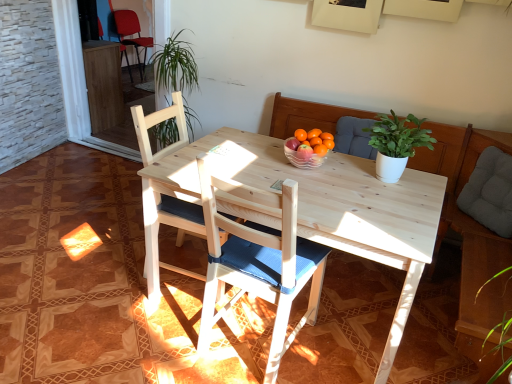
Question: Considering the relative positions of matte red chair at upper left, positioned as the first chair in top-to-bottom order, and wooden chair with blue cushion at center, which is the 1th chair in front-to-back order, in the image provided, is matte red chair at upper left, positioned as the first chair in top-to-bottom order, to the right of wooden chair with blue cushion at center, which is the 1th chair in front-to-back order, from the viewer's perspective?

Choices:
 (A) yes
 (B) no

Answer: (B)

Question: Could you tell me if matte red chair at upper left, the 3th chair ordered from the bottom, is facing wooden chair with blue cushion at center, the first chair when ordered from right to left?

Choices:
 (A) yes
 (B) no

Answer: (B)

Question: From the image's perspective, is matte red chair at upper left, the 3th chair ordered from the bottom, below wooden chair with blue cushion at center, the third chair from the top?

Choices:
 (A) yes
 (B) no

Answer: (B)

Question: Does matte red chair at upper left, the 1th chair from the left, have a lesser width compared to wooden chair with blue cushion at center, the third chair from the top?

Choices:
 (A) no
 (B) yes

Answer: (A)

Question: Can we say matte red chair at upper left, the third chair positioned from the right, lies outside wooden chair with blue cushion at center, which is counted as the third chair, starting from the back?

Choices:
 (A) yes
 (B) no

Answer: (A)

Question: Is matte red chair at upper left, the third chair positioned from the right, inside or outside of wooden chair with blue cushion at center, which is the 1th chair in front-to-back order?

Choices:
 (A) inside
 (B) outside

Answer: (B)

Question: Is matte red chair at upper left, the 3th chair ordered from the bottom, in front of or behind wooden chair with blue cushion at center, which is counted as the third chair, starting from the back, in the image?

Choices:
 (A) front
 (B) behind

Answer: (B)

Question: Based on their positions, is matte red chair at upper left, the third chair positioned from the right, located to the left or right of wooden chair with blue cushion at center, which is counted as the third chair, starting from the back?

Choices:
 (A) left
 (B) right

Answer: (A)

Question: In terms of height, does matte red chair at upper left, the third chair in the front-to-back sequence, look taller or shorter compared to wooden chair with blue cushion at center, the first chair when ordered from right to left?

Choices:
 (A) tall
 (B) short

Answer: (B)

Question: Is wooden chair with blue cushion at center, arranged as the first chair when ordered from the bottom, situated inside white matte plant at upper center or outside?

Choices:
 (A) outside
 (B) inside

Answer: (A)

Question: In terms of width, does wooden chair with blue cushion at center, which is the 1th chair in front-to-back order, look wider or thinner when compared to white matte plant at upper center?

Choices:
 (A) wide
 (B) thin

Answer: (A)

Question: Is wooden chair with blue cushion at center, the first chair when ordered from right to left, taller or shorter than white matte plant at upper center?

Choices:
 (A) short
 (B) tall

Answer: (B)

Question: From a real-world perspective, is wooden chair with blue cushion at center, the third chair in the left-to-right sequence, positioned above or below white matte plant at upper center?

Choices:
 (A) above
 (B) below

Answer: (B)

Question: Considering their positions, is gray fabric cushion at right located in front of or behind wooden chair at center, marked as the second chair in a back-to-front arrangement?

Choices:
 (A) front
 (B) behind

Answer: (B)

Question: Looking at the image, does gray fabric cushion at right seem bigger or smaller compared to wooden chair at center, which appears as the 2th chair when ordered from the bottom?

Choices:
 (A) small
 (B) big

Answer: (A)